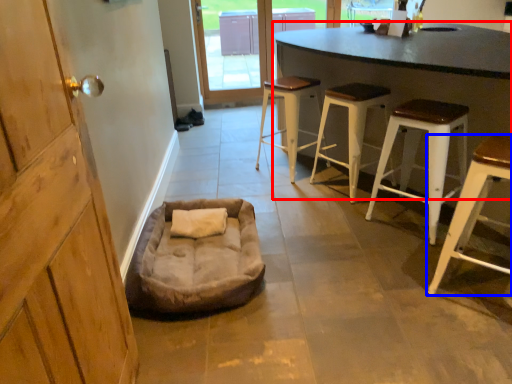
Question: Which of the following is the closest to the observer, table (highlighted by a red box) or stool (highlighted by a blue box)?

Choices:
 (A) table
 (B) stool

Answer: (A)